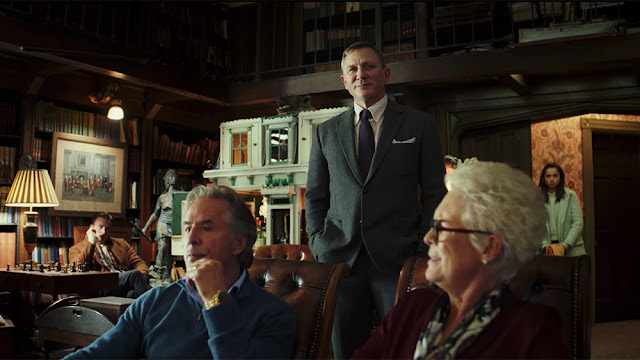
This screenshot has width=640, height=360. I want to click on chess pieces, so click(x=73, y=268), click(x=57, y=269), click(x=38, y=269), click(x=29, y=269), click(x=22, y=269), click(x=6, y=270).